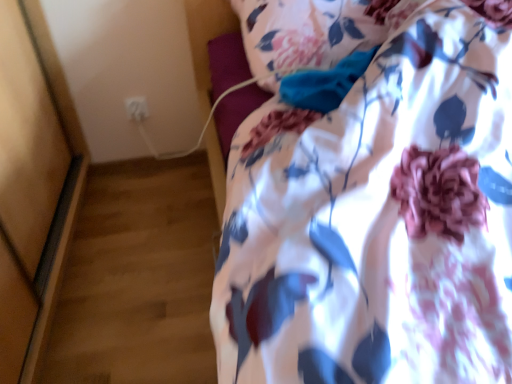
Question: From a real-world perspective, is white plastic electric outlet at upper left under floral fabric pillow at upper center?

Choices:
 (A) no
 (B) yes

Answer: (B)

Question: Is white plastic electric outlet at upper left thinner than floral fabric pillow at upper center?

Choices:
 (A) yes
 (B) no

Answer: (A)

Question: Can you confirm if white plastic electric outlet at upper left is shorter than floral fabric pillow at upper center?

Choices:
 (A) yes
 (B) no

Answer: (A)

Question: Is white plastic electric outlet at upper left oriented away from floral fabric pillow at upper center?

Choices:
 (A) yes
 (B) no

Answer: (B)

Question: Is white plastic electric outlet at upper left in front of floral fabric pillow at upper center?

Choices:
 (A) yes
 (B) no

Answer: (B)

Question: Does white plastic electric outlet at upper left lie behind floral fabric pillow at upper center?

Choices:
 (A) yes
 (B) no

Answer: (A)

Question: Is floral fabric pillow at upper center positioned in front of white plastic electric outlet at upper left?

Choices:
 (A) yes
 (B) no

Answer: (A)

Question: From a real-world perspective, is floral fabric pillow at upper center positioned over white plastic electric outlet at upper left based on gravity?

Choices:
 (A) yes
 (B) no

Answer: (A)

Question: Can you confirm if floral fabric pillow at upper center is positioned to the right of white plastic electric outlet at upper left?

Choices:
 (A) no
 (B) yes

Answer: (B)

Question: Is floral fabric pillow at upper center to the left of white plastic electric outlet at upper left from the viewer's perspective?

Choices:
 (A) yes
 (B) no

Answer: (B)

Question: Is floral fabric pillow at upper center oriented away from white plastic electric outlet at upper left?

Choices:
 (A) no
 (B) yes

Answer: (A)

Question: Is floral fabric pillow at upper center facing towards white plastic electric outlet at upper left?

Choices:
 (A) yes
 (B) no

Answer: (B)

Question: In the image, is floral fabric pillow at upper center on the left side or the right side of white plastic electric outlet at upper left?

Choices:
 (A) right
 (B) left

Answer: (A)